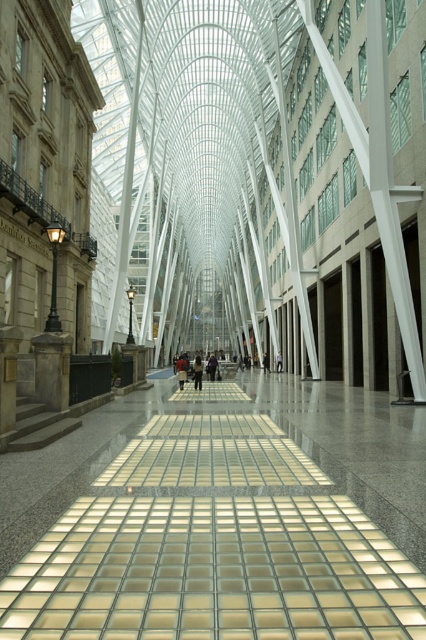
Question: Observing the image, what is the correct spatial positioning of translucent glass floor at center in reference to dark clothing at center?

Choices:
 (A) left
 (B) right

Answer: (B)

Question: Which point is closer to the camera taking this photo?

Choices:
 (A) (195, 381)
 (B) (181, 374)

Answer: (B)

Question: Which is farther from the dark clothing at center?

Choices:
 (A) brown leather jacket at center
 (B) translucent glass floor at center

Answer: (B)

Question: Is brown leather jacket at center above dark clothing at center?

Choices:
 (A) no
 (B) yes

Answer: (A)

Question: Is brown leather jacket at center positioned behind dark clothing at center?

Choices:
 (A) no
 (B) yes

Answer: (A)

Question: Which point appears closest to the camera in this image?

Choices:
 (A) (264, 365)
 (B) (199, 364)
 (C) (184, 376)
 (D) (3, 611)

Answer: (D)